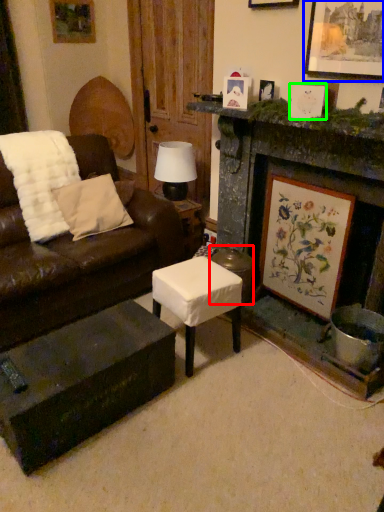
Question: Considering the real-world distances, which object is farthest from stool (highlighted by a red box)? picture frame (highlighted by a blue box) or picture frame (highlighted by a green box)?

Choices:
 (A) picture frame
 (B) picture frame

Answer: (A)